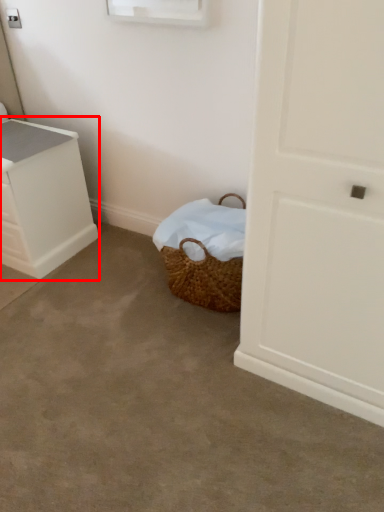
Question: From the image's perspective, where is chest of drawers (annotated by the red box) located relative to concrete?

Choices:
 (A) above
 (B) below

Answer: (A)